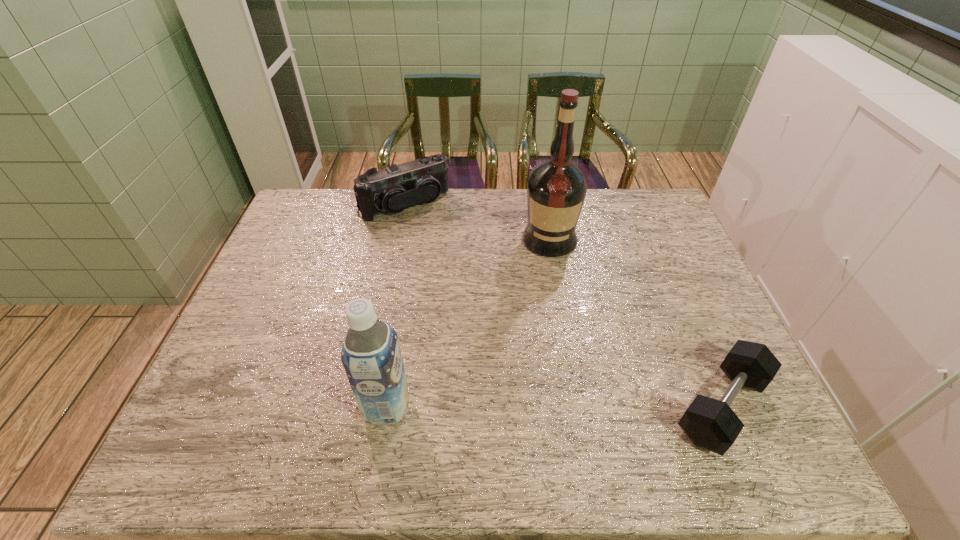
At what (x,y) coordinates should I click in order to perform the action: click on vacant space on the desktop that is between the second tallest object and the rightmost object and is positioned on the surface of the tallest object. Please return your answer as a coordinate pair (x, y). The height and width of the screenshot is (540, 960). Looking at the image, I should click on (541, 407).

Image resolution: width=960 pixels, height=540 pixels. In order to click on free spot on the desktop that is between the third shortest object and the dumbbell and is positioned on the front-facing side of the camcorder in this screenshot , I will do `click(548, 407)`.